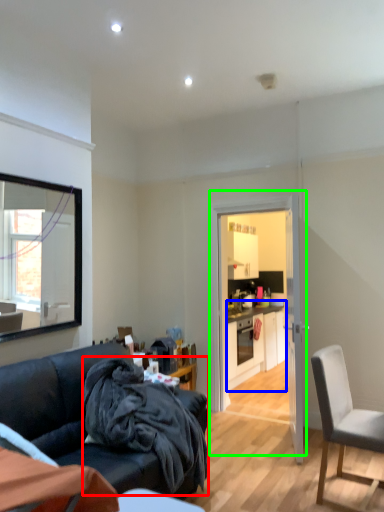
Question: Which object is the closest to the blanket (highlighted by a red box)? Choose among these: cabinetry (highlighted by a blue box) or door (highlighted by a green box).

Choices:
 (A) cabinetry
 (B) door

Answer: (B)